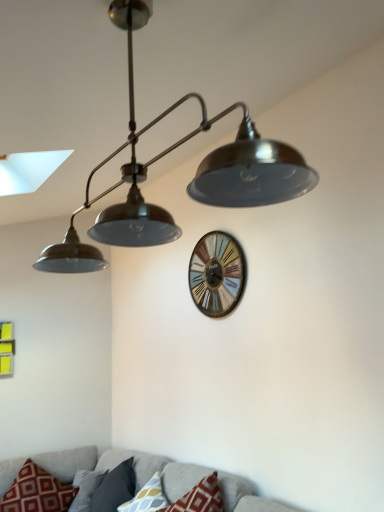
Question: From the image's perspective, is red printed cushion at lower left, the third pillow viewed from the right, located above or below textured gray couch at lower center?

Choices:
 (A) above
 (B) below

Answer: (B)

Question: In the image, is red printed cushion at lower left, the third pillow viewed from the right, positioned in front of or behind textured gray couch at lower center?

Choices:
 (A) front
 (B) behind

Answer: (B)

Question: Estimate the real-world distances between objects in this image. Which object is closer to the patterned fabric pillow at lower center, placed as the 1th pillow when sorted from right to left?

Choices:
 (A) wooden wall clock at center
 (B) gray fabric pillow at lower center, which is counted as the 2th pillow, starting from the left
 (C) textured gray couch at lower center
 (D) red printed cushion at lower left, the third pillow viewed from the right

Answer: (C)

Question: Estimate the real-world distances between objects in this image. Which object is farther from the patterned fabric pillow at lower center, placed as the 1th pillow when sorted from right to left?

Choices:
 (A) wooden wall clock at center
 (B) red printed cushion at lower left, the third pillow viewed from the right
 (C) textured gray couch at lower center
 (D) gray fabric pillow at lower center, which is counted as the 2th pillow, starting from the left

Answer: (A)